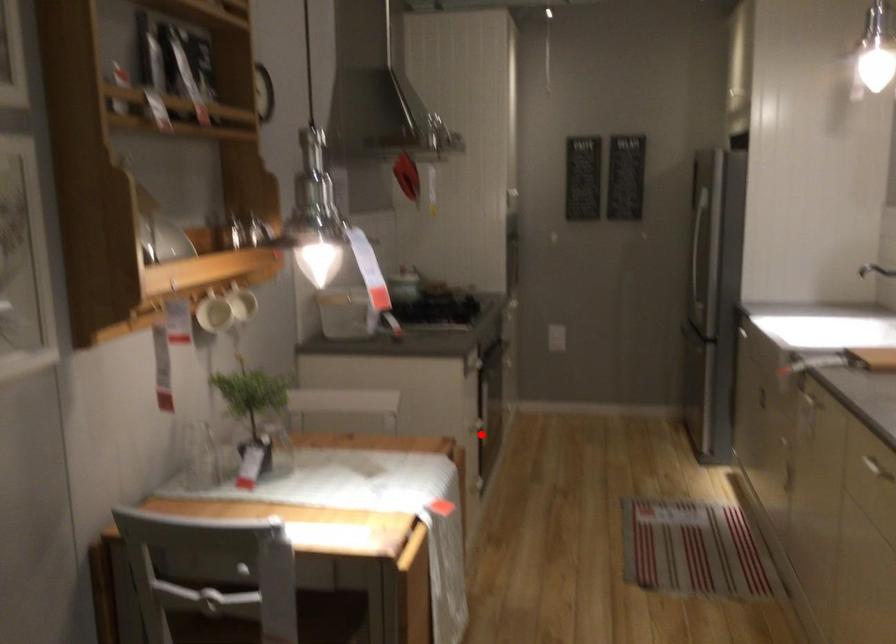
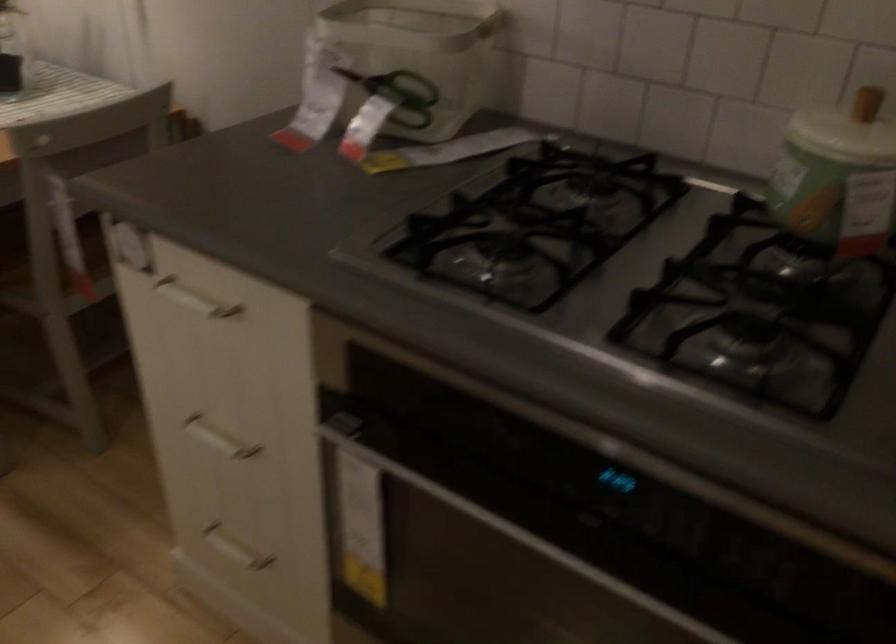
Question: I am providing you with two images of the same scene from different viewpoints. A red point is marked on the first image. Can you still see the location of the red point in image 2?

Choices:
 (A) Yes
 (B) No

Answer: (A)